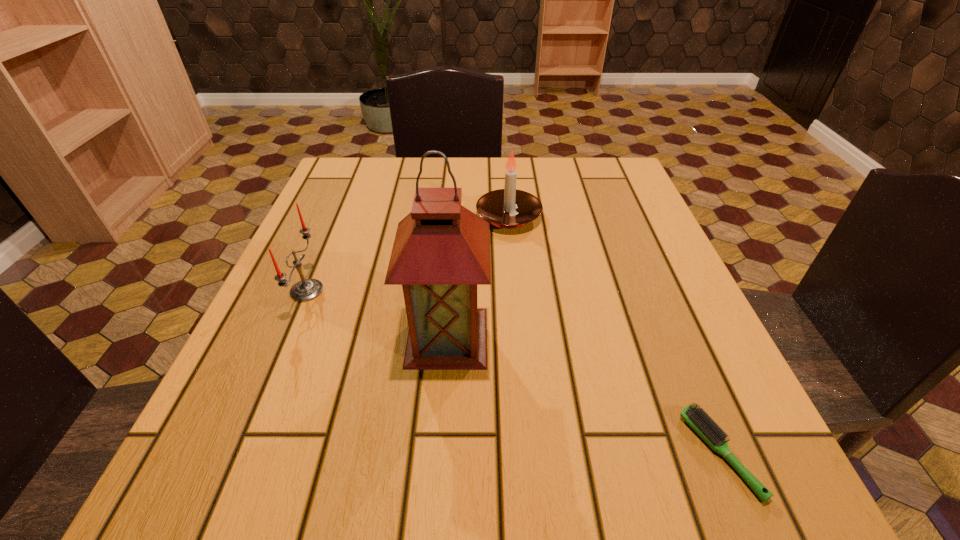
Locate an element on the screen. Image resolution: width=960 pixels, height=540 pixels. object that is the third closest one to the nearer candle is located at coordinates (697, 418).

Where is `free space that satisfies the following two spatial constraints: 1. on the back side of the farthest object; 2. on the left side of the tallest object`? The width and height of the screenshot is (960, 540). free space that satisfies the following two spatial constraints: 1. on the back side of the farthest object; 2. on the left side of the tallest object is located at coordinates (456, 217).

Identify the location of free space that satisfies the following two spatial constraints: 1. on the back side of the shortest object; 2. on the front-facing side of the nearer candle. (652, 291).

Locate an element on the screen. The image size is (960, 540). free location that satisfies the following two spatial constraints: 1. on the back side of the tallest object; 2. on the front-facing side of the leftmost object is located at coordinates (450, 291).

Where is `free spot that satisfies the following two spatial constraints: 1. on the back side of the hairbrush; 2. on the front-facing side of the nearer candle`? This screenshot has width=960, height=540. free spot that satisfies the following two spatial constraints: 1. on the back side of the hairbrush; 2. on the front-facing side of the nearer candle is located at coordinates (652, 291).

Find the location of a particular element. This screenshot has width=960, height=540. vacant space that satisfies the following two spatial constraints: 1. on the front side of the right candle; 2. on the front-facing side of the nearer candle is located at coordinates (515, 291).